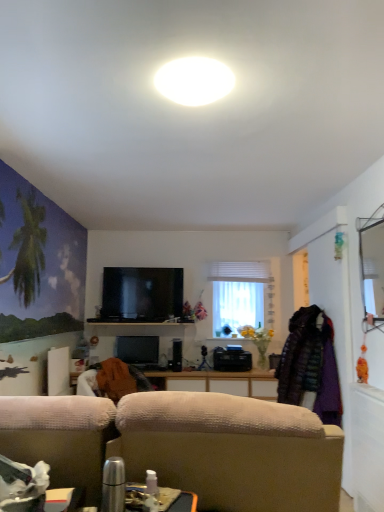
The width and height of the screenshot is (384, 512). I want to click on vacant space underneath black glossy flat-screen tv at center, which appears as the second television when ordered from the bottom (from a real-world perspective), so click(144, 321).